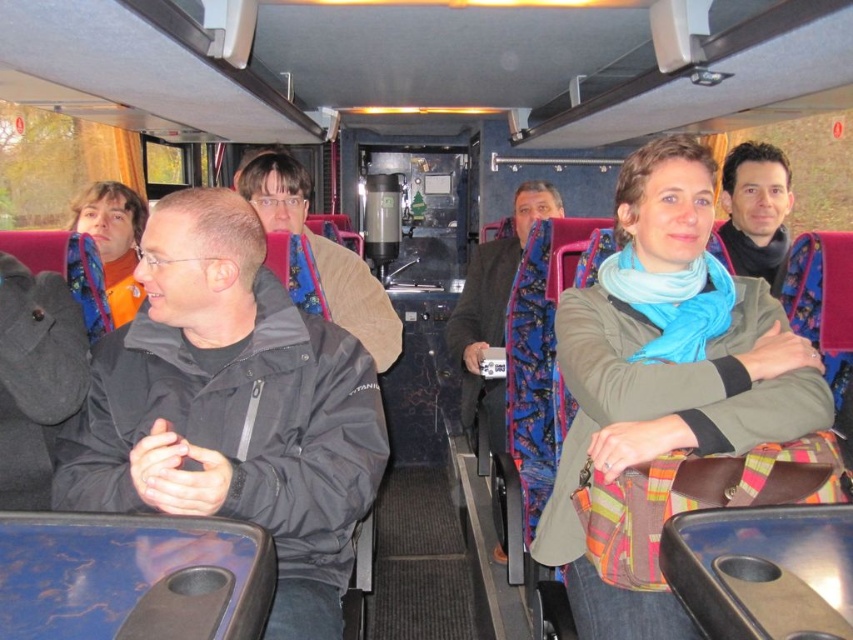
From the picture: Who is positioned more to the right, light blue scarf at center or blue patterned coat at center?

light blue scarf at center

Who is taller, light blue scarf at center or blue patterned coat at center?

blue patterned coat at center

Which is behind, point (611, 435) or point (473, 260)?

Point (473, 260)

Where is `light blue scarf at center`? Image resolution: width=853 pixels, height=640 pixels. light blue scarf at center is located at coordinates (666, 371).

Does black matte jacket at left lie in front of light blue scarf at center?

Yes, it is.

Is point (88, 420) positioned in front of point (631, 420)?

That is False.

Where is `black matte jacket at left`? The width and height of the screenshot is (853, 640). black matte jacket at left is located at coordinates (231, 408).

Is point (281, 339) in front of point (485, 250)?

Yes, point (281, 339) is closer to viewer.

Is point (175, 288) in front of point (511, 280)?

That is True.

Locate an element on the screen. black matte jacket at left is located at coordinates (231, 408).